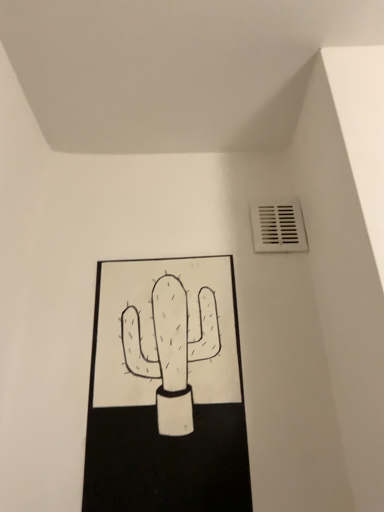
Question: Are white matte cactus at center and white plastic vent at upper right beside each other?

Choices:
 (A) no
 (B) yes

Answer: (A)

Question: Is white matte cactus at center oriented towards white plastic vent at upper right?

Choices:
 (A) yes
 (B) no

Answer: (B)

Question: Is white matte cactus at center at the left side of white plastic vent at upper right?

Choices:
 (A) no
 (B) yes

Answer: (B)

Question: Is white matte cactus at center turned away from white plastic vent at upper right?

Choices:
 (A) no
 (B) yes

Answer: (A)

Question: Does white matte cactus at center have a lesser width compared to white plastic vent at upper right?

Choices:
 (A) yes
 (B) no

Answer: (B)

Question: Does white matte cactus at center have a larger size compared to white plastic vent at upper right?

Choices:
 (A) yes
 (B) no

Answer: (A)

Question: Is white plastic vent at upper right oriented towards white matte cactus at center?

Choices:
 (A) no
 (B) yes

Answer: (A)

Question: From a real-world perspective, is white plastic vent at upper right physically above white matte cactus at center?

Choices:
 (A) yes
 (B) no

Answer: (A)

Question: Considering the relative sizes of white plastic vent at upper right and white matte cactus at center in the image provided, is white plastic vent at upper right taller than white matte cactus at center?

Choices:
 (A) no
 (B) yes

Answer: (A)

Question: Is white plastic vent at upper right facing away from white matte cactus at center?

Choices:
 (A) no
 (B) yes

Answer: (A)

Question: Is the depth of white plastic vent at upper right less than that of white matte cactus at center?

Choices:
 (A) yes
 (B) no

Answer: (B)

Question: Can we say white plastic vent at upper right lies outside white matte cactus at center?

Choices:
 (A) yes
 (B) no

Answer: (A)

Question: From the image's perspective, is white plastic vent at upper right located above or below white matte cactus at center?

Choices:
 (A) above
 (B) below

Answer: (A)